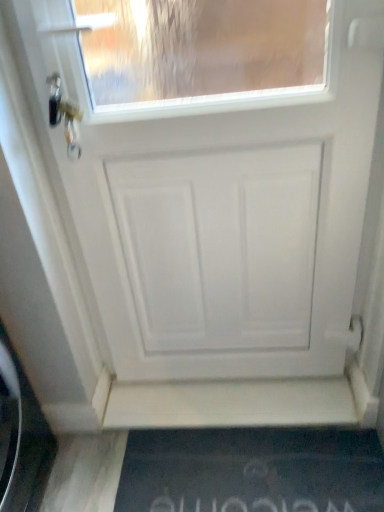
This screenshot has width=384, height=512. I want to click on black rubber doormat at lower center, so click(x=252, y=471).

What is the approximate width of black rubber doormat at lower center?

black rubber doormat at lower center is 10.36 inches in width.

The height and width of the screenshot is (512, 384). What do you see at coordinates (252, 471) in the screenshot? I see `black rubber doormat at lower center` at bounding box center [252, 471].

Measure the distance between white matte door at center and camera.

white matte door at center is 32.16 inches from camera.

What do you see at coordinates (215, 175) in the screenshot? The height and width of the screenshot is (512, 384). I see `white matte door at center` at bounding box center [215, 175].

What is the approximate width of white matte door at center?

The width of white matte door at center is 6.05 inches.

This screenshot has width=384, height=512. What are the coordinates of `white matte door at center` in the screenshot? It's located at (215, 175).

Image resolution: width=384 pixels, height=512 pixels. Find the location of `black rubber doormat at lower center`. black rubber doormat at lower center is located at coordinates (252, 471).

Between black rubber doormat at lower center and white matte door at center, which one appears on the right side from the viewer's perspective?

From the viewer's perspective, black rubber doormat at lower center appears more on the right side.

Who is more distant, black rubber doormat at lower center or white matte door at center?

black rubber doormat at lower center is further away from the camera.

Is point (305, 509) less distant than point (248, 151)?

No, it is not.

From the image's perspective, is black rubber doormat at lower center positioned above or below white matte door at center?

black rubber doormat at lower center is situated lower than white matte door at center in the image.

From a real-world perspective, which is physically below, black rubber doormat at lower center or white matte door at center?

black rubber doormat at lower center is physically lower.

Considering the sizes of objects black rubber doormat at lower center and white matte door at center in the image provided, who is thinner, black rubber doormat at lower center or white matte door at center?

white matte door at center.

Which of these two, black rubber doormat at lower center or white matte door at center, stands shorter?

With less height is black rubber doormat at lower center.

Between black rubber doormat at lower center and white matte door at center, which one has larger size?

white matte door at center.

Is white matte door at center surrounded by black rubber doormat at lower center?

No.

Is black rubber doormat at lower center far away from white matte door at center?

Actually, black rubber doormat at lower center and white matte door at center are a little close together.

Could you tell me if black rubber doormat at lower center is turned towards white matte door at center?

No, black rubber doormat at lower center does not turn towards white matte door at center.

How distant is black rubber doormat at lower center from white matte door at center?

A distance of 16.07 inches exists between black rubber doormat at lower center and white matte door at center.

The width and height of the screenshot is (384, 512). I want to click on doormat on the right of white matte door at center, so click(252, 471).

Between white matte door at center and black rubber doormat at lower center, which one appears on the right side from the viewer's perspective?

black rubber doormat at lower center.

Does white matte door at center come behind black rubber doormat at lower center?

No, it is not.

Is point (372, 219) behind point (247, 456)?

No.

From the image's perspective, is white matte door at center above or below black rubber doormat at lower center?

white matte door at center is above black rubber doormat at lower center.

From a real-world perspective, which is physically below, white matte door at center or black rubber doormat at lower center?

From a 3D spatial view, black rubber doormat at lower center is below.

In terms of width, does white matte door at center look wider or thinner when compared to black rubber doormat at lower center?

In the image, white matte door at center appears to be more narrow than black rubber doormat at lower center.

Does white matte door at center have a lesser height compared to black rubber doormat at lower center?

No, white matte door at center is not shorter than black rubber doormat at lower center.

Who is bigger, white matte door at center or black rubber doormat at lower center?

With larger size is white matte door at center.

Is black rubber doormat at lower center a part of white matte door at center?

Actually, black rubber doormat at lower center is outside white matte door at center.

Are white matte door at center and black rubber doormat at lower center beside each other?

No, white matte door at center is not touching black rubber doormat at lower center.

Is white matte door at center aimed at black rubber doormat at lower center?

Yes, white matte door at center is turned towards black rubber doormat at lower center.

What's the angular difference between white matte door at center and black rubber doormat at lower center's facing directions?

There is a 0.793-degree angle between the facing directions of white matte door at center and black rubber doormat at lower center.

Where is `doormat that is on the right side of white matte door at center`? doormat that is on the right side of white matte door at center is located at coordinates (252, 471).

Locate an element on the screen. The height and width of the screenshot is (512, 384). door on the left of black rubber doormat at lower center is located at coordinates (215, 175).

The width and height of the screenshot is (384, 512). I want to click on door that appears above the black rubber doormat at lower center (from a real-world perspective), so click(x=215, y=175).